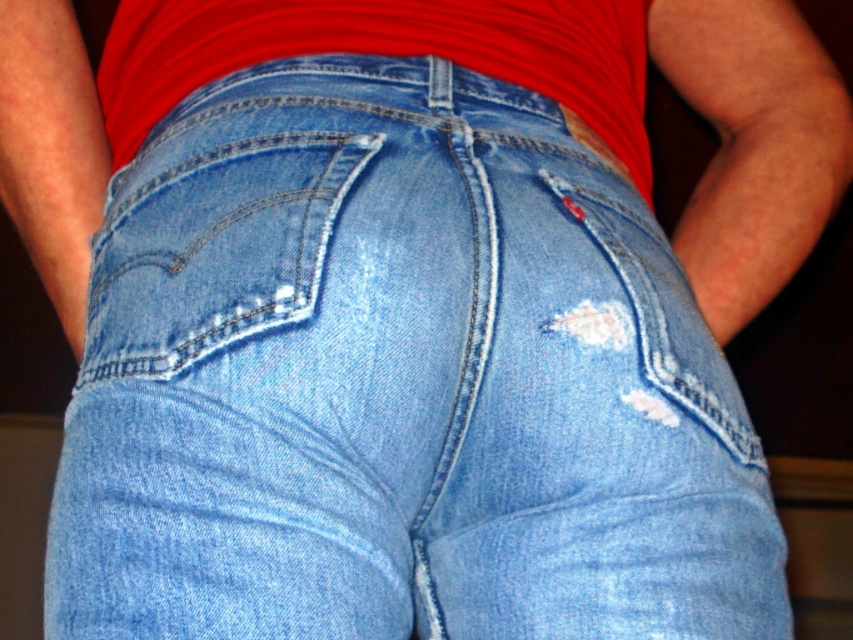
You are a fashion designer examining the jeans and shirt in the image. You notice two points marked on the image. The first point is at coordinates point [120,312] and the second point is at point [193,26]. From the perspective of someone looking at the jeans, which point is closer to the viewer?

Point [120,312] is in front of point [193,26], so it is closer to the viewer.

You are a fashion designer looking at this outfit. If you want to place a decorative pin on the light blue denim pocket at center and the red cotton shirt at center, which one should you choose to ensure the pin is visible from the front?

The light blue denim pocket at center is in front of the red cotton shirt at center, so placing the pin on the light blue denim pocket at center will ensure it is visible from the front.